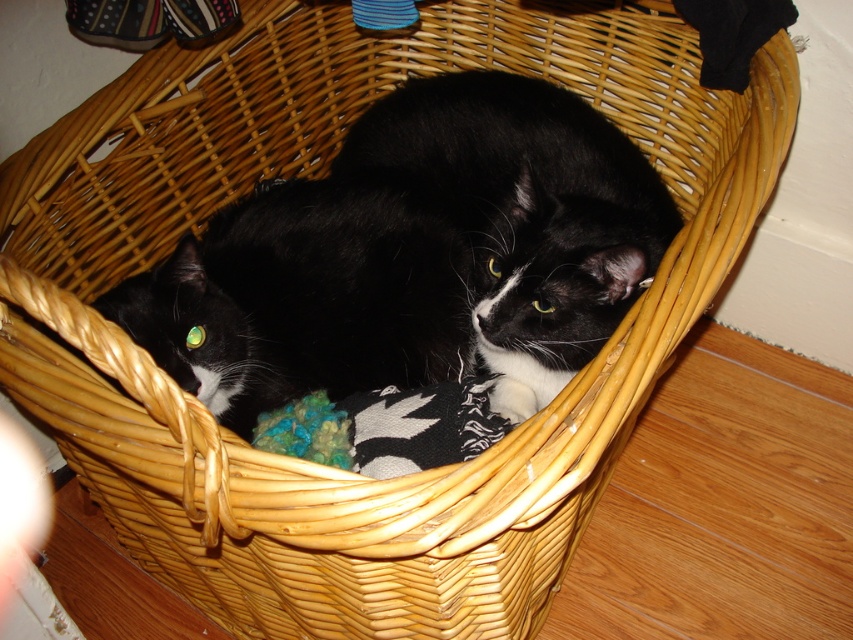
Is black fur cat at center to the left of multicolored yarn ball at center from the viewer's perspective?

Incorrect, black fur cat at center is not on the left side of multicolored yarn ball at center.

Who is positioned more to the right, black fur cat at center or multicolored yarn ball at center?

Positioned to the right is black fur cat at center.

Locate an element on the screen. black fur cat at center is located at coordinates (415, 257).